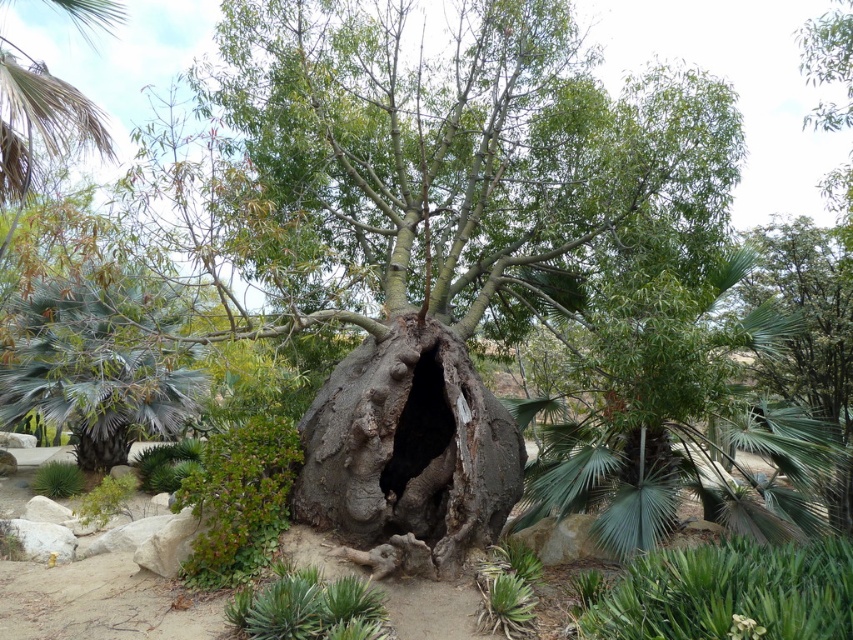
You are a hiker who wants to climb the rough bark tree trunk at center. You notice the dark rough bark hole at center. Which part of the tree is wider, the trunk or the hole?

The rough bark tree trunk at center is wider than the dark rough bark hole at center according to the description.

In the scene shown: You are standing in the natural scene described. You see a point marked at coordinates (674, 424). What object is located at that point?

The point at coordinates (674, 424) marks the green leafy palm at upper center.